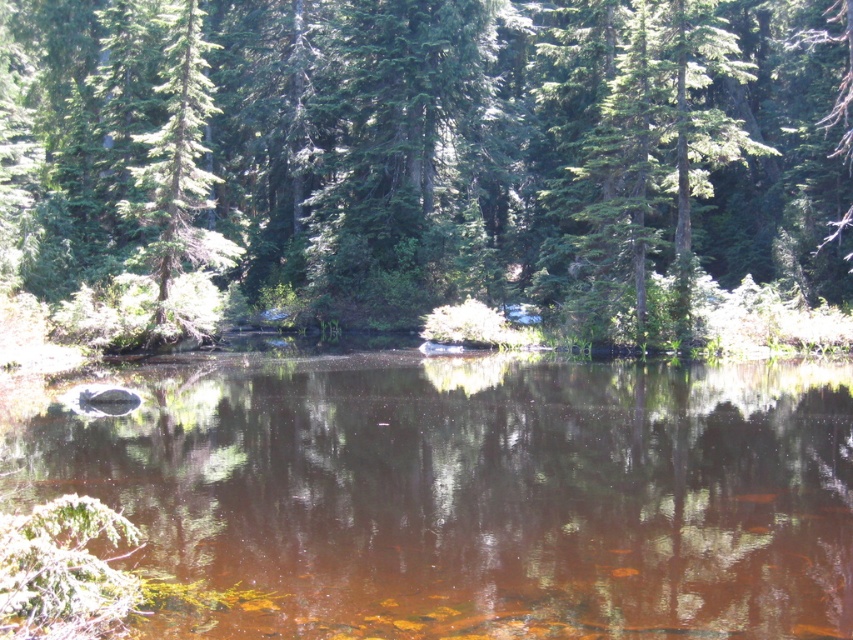
You are a hiker standing at the edge of the forest and see the green matte tree at center and the green matte tree at left. Which tree is positioned higher up in the image?

The green matte tree at center is located above the green matte tree at left, so it is positioned higher up in the image.

You are a photographer planning to capture the green matte tree at center and the brown reflective water at center in a single frame. Based on their sizes, which object should you focus on to ensure both are clearly visible in the photo?

The green matte tree at center is bigger than the brown reflective water at center, so focusing on the green matte tree at center will ensure both objects are clearly visible since it occupies more space in the frame.

You are standing at the edge of a forest lake and see the green matte tree at center. If you want to take a photo of it from exactly 25 meters away, should you move closer or farther away?

The green matte tree at center is currently 27.18 meters away. To get to 25 meters, you need to move closer by 2.18 meters.